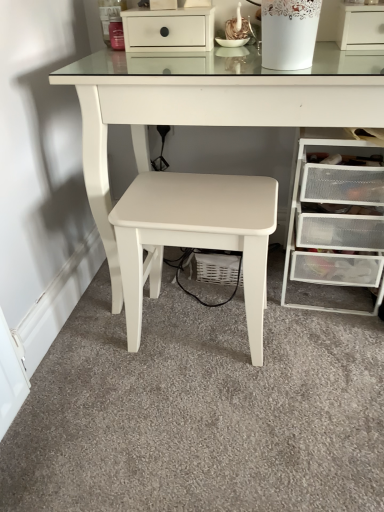
Question: From a real-world perspective, does clear plastic drawers at lower right, arranged as the first chest of drawers when ordered from the bottom, stand above white matte stool at center?

Choices:
 (A) yes
 (B) no

Answer: (A)

Question: Does clear plastic drawers at lower right, which appears as the second chest of drawers when viewed from the top, turn towards white matte stool at center?

Choices:
 (A) yes
 (B) no

Answer: (B)

Question: Is clear plastic drawers at lower right, arranged as the first chest of drawers when ordered from the bottom, oriented away from white matte stool at center?

Choices:
 (A) no
 (B) yes

Answer: (A)

Question: Is clear plastic drawers at lower right, which appears as the second chest of drawers when viewed from the top, not within white matte stool at center?

Choices:
 (A) yes
 (B) no

Answer: (A)

Question: Is white matte stool at center surrounded by clear plastic drawers at lower right, which appears as the 1th chest of drawers when viewed from the right?

Choices:
 (A) yes
 (B) no

Answer: (B)

Question: Considering the relative sizes of clear plastic drawers at lower right, which appears as the 1th chest of drawers when viewed from the right, and white matte stool at center in the image provided, is clear plastic drawers at lower right, which appears as the 1th chest of drawers when viewed from the right, shorter than white matte stool at center?

Choices:
 (A) no
 (B) yes

Answer: (A)

Question: Does clear plastic drawers at lower right, which appears as the 1th chest of drawers when viewed from the right, have a greater height compared to white porcelain vase at upper center?

Choices:
 (A) yes
 (B) no

Answer: (A)

Question: Is clear plastic drawers at lower right, which appears as the second chest of drawers when viewed from the top, oriented away from white porcelain vase at upper center?

Choices:
 (A) yes
 (B) no

Answer: (B)

Question: From a real-world perspective, is clear plastic drawers at lower right, which appears as the second chest of drawers when viewed from the top, positioned under white porcelain vase at upper center based on gravity?

Choices:
 (A) yes
 (B) no

Answer: (A)

Question: From the image's perspective, does clear plastic drawers at lower right, which appears as the second chest of drawers when viewed from the top, appear lower than white porcelain vase at upper center?

Choices:
 (A) no
 (B) yes

Answer: (B)

Question: Considering the relative sizes of clear plastic drawers at lower right, arranged as the first chest of drawers when ordered from the bottom, and white porcelain vase at upper center in the image provided, is clear plastic drawers at lower right, arranged as the first chest of drawers when ordered from the bottom, smaller than white porcelain vase at upper center?

Choices:
 (A) yes
 (B) no

Answer: (B)

Question: Is white matte drawer at upper center, which ranks as the 2th chest of drawers in right-to-left order, inside clear plastic drawers at lower right, which appears as the second chest of drawers when viewed from the top?

Choices:
 (A) yes
 (B) no

Answer: (B)